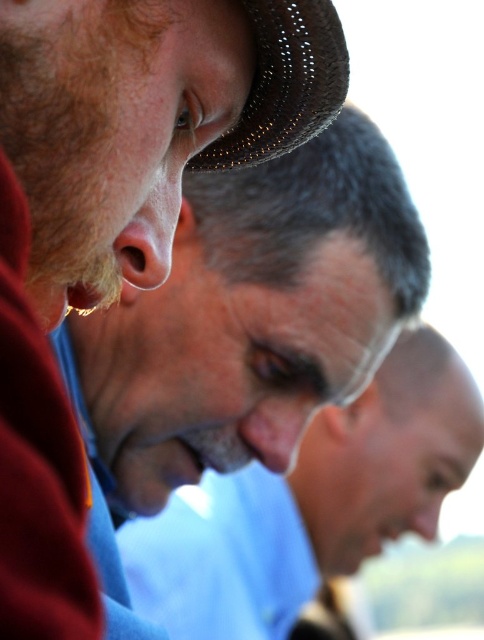
You are a photographer adjusting your camera settings to focus on the gray matte face at center and the woven straw hat at upper left. Which object should you focus on first to ensure it appears sharp in the photo?

The gray matte face at center should be focused on first because it is closer to the viewer than the woven straw hat at upper left, so focusing on it will ensure it appears sharp while the hat may be slightly out of focus due to depth of field limitations.

You are a photographer trying to adjust the focus of your camera to capture the brown textured hat at upper left and the woven straw hat at upper left. Since both hats are at the upper left, which one is closer to the camera?

The brown textured hat at upper left is closer to the camera because the woven straw hat at upper left is behind it.

Looking at this image, you are a photographer adjusting the camera focus. You notice the brown textured hat at upper left and the gray matte face at center. Which object should you focus on first if you want to ensure the closer one is sharp?

The brown textured hat at upper left should be focused on first because it has a lesser height compared to the gray matte face at center, indicating it is closer to the camera.